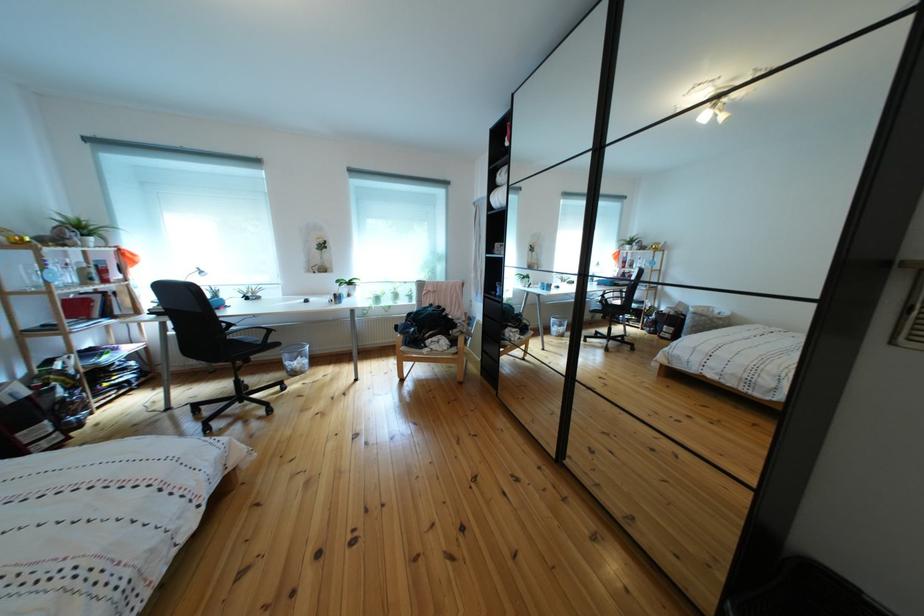
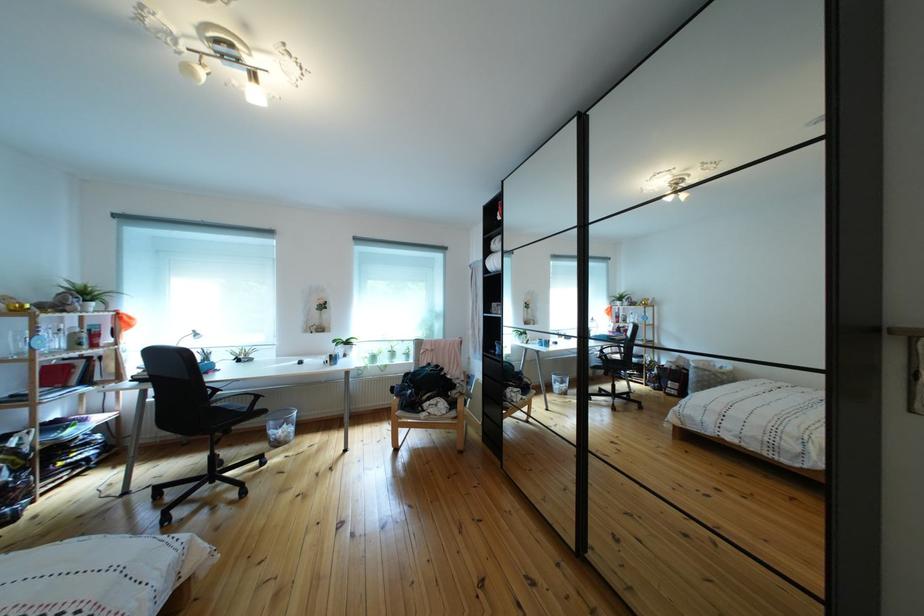
Find the pixel in the second image that matches [297,362] in the first image.

(283, 430)